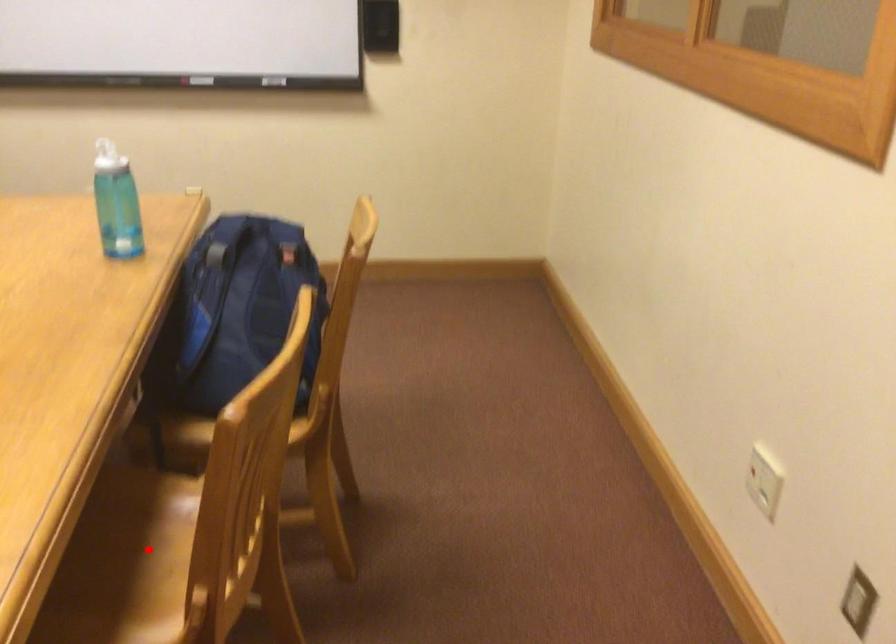
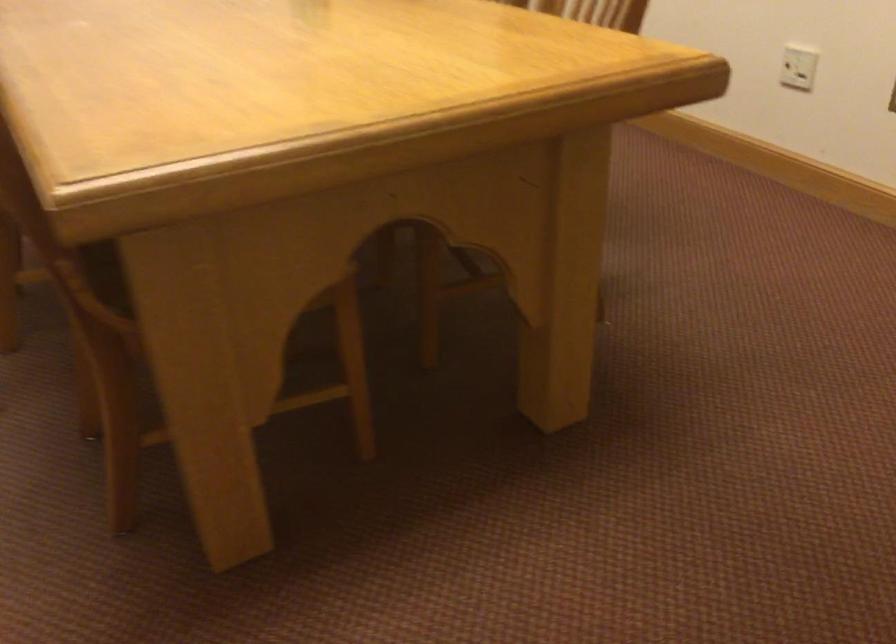
Question: I am providing you with two images of the same scene from different viewpoints. A red point is marked on the first image. At the location where the point appears in image 1, is it still visible in image 2?

Choices:
 (A) Yes
 (B) No

Answer: (B)